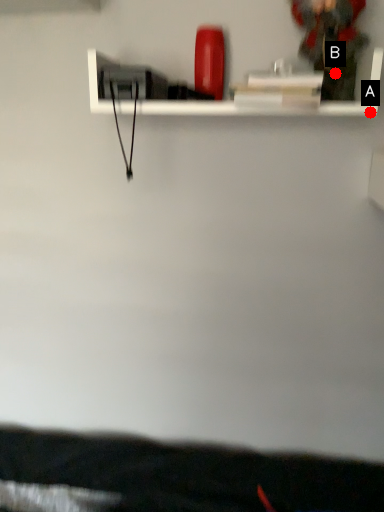
Question: Two points are circled on the image, labeled by A and B beside each circle. Which point is closer to the camera?

Choices:
 (A) A is closer
 (B) B is closer

Answer: (A)